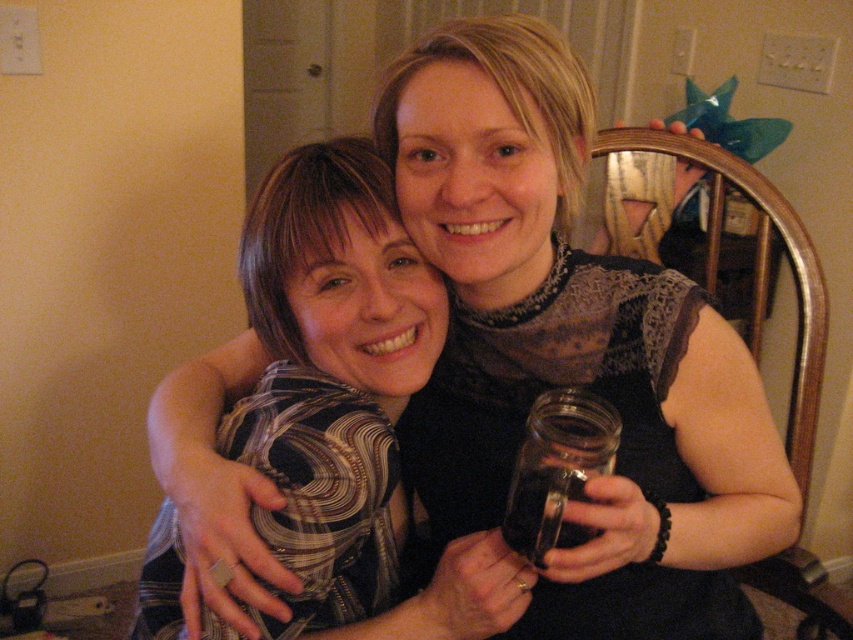
You are designing a living room layout and need to place both the patterned fabric shirt at center and the wooden chair at upper right. Considering their sizes, which object should be placed closer to the entrance to ensure there is enough space for people to walk comfortably?

The patterned fabric shirt at center is shorter than the wooden chair at upper right, so placing the wooden chair at upper right closer to the entrance would allow more space for walking since it is taller and might require more clearance.

You are standing in a cozy living room and see both the patterned fabric shirt at center and the transparent glass jar at center. Which object is located to the left of the other?

The patterned fabric shirt at center is positioned on the left side of transparent glass jar at center.